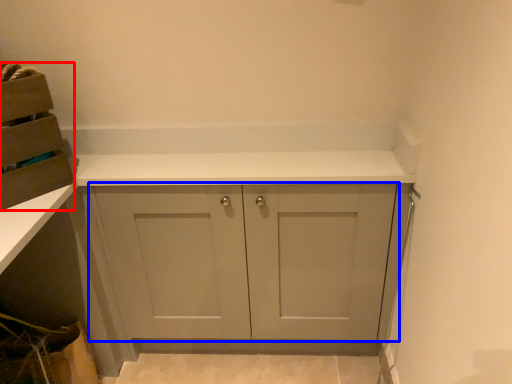
Question: Which object appears farthest to the camera in this image, cabinetry (highlighted by a red box) or cabinetry (highlighted by a blue box)?

Choices:
 (A) cabinetry
 (B) cabinetry

Answer: (B)